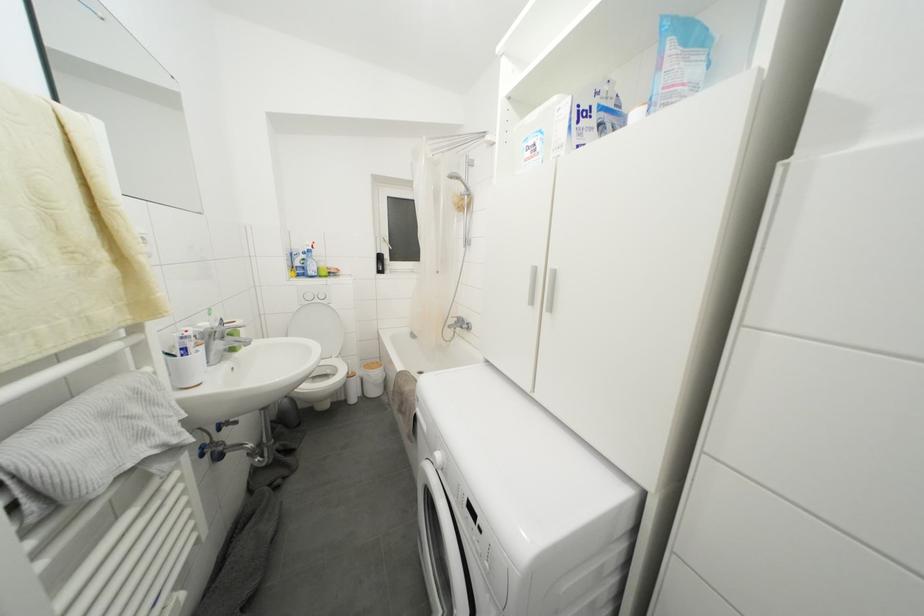
Locate an element on the screen. white detergent box is located at coordinates (542, 132).